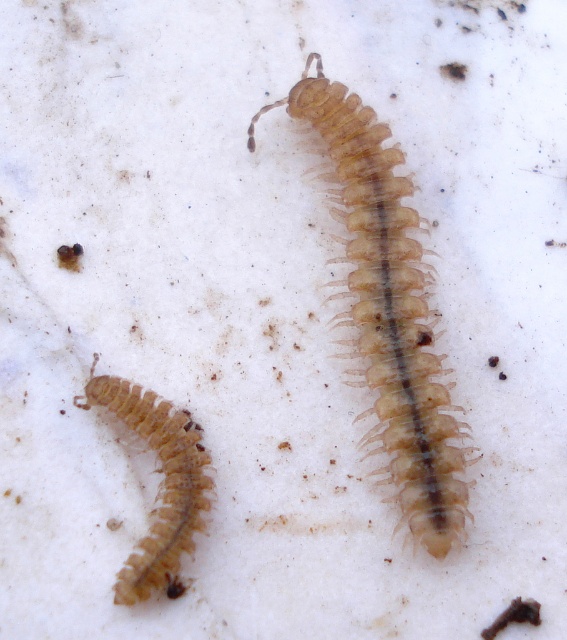
From the picture: You are observing two translucent beige centipedes on a white surface. Which one is closer to you, the translucent beige centipede at center or the translucent beige centipede at lower left?

The translucent beige centipede at center is closer to you because it is further to the viewer than the translucent beige centipede at lower left.